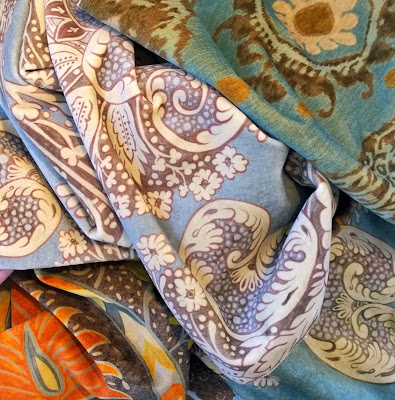
Locate an element on the screen. The height and width of the screenshot is (400, 395). fabric is located at coordinates (256, 177).